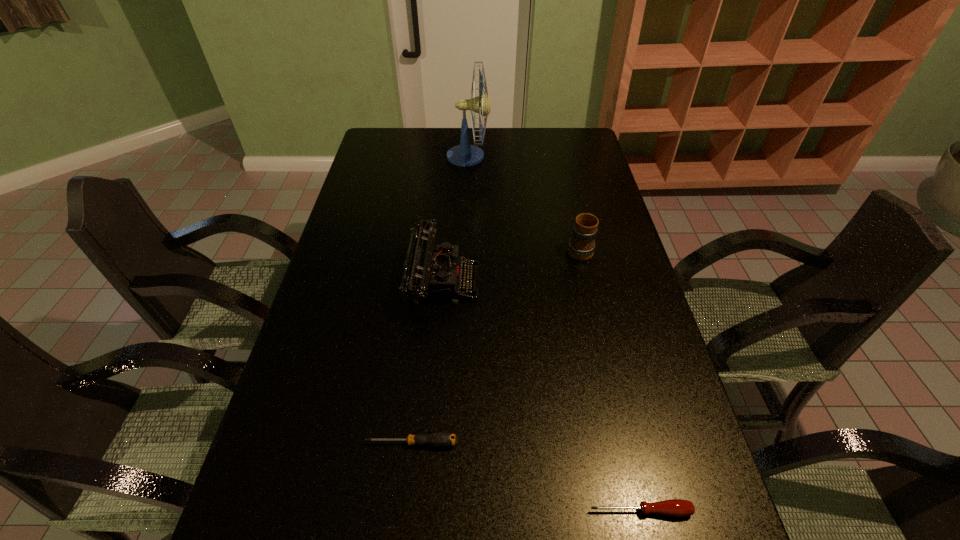
You are a GUI agent. You are given a task and a screenshot of the screen. Output one action in this format:
    pyautogui.click(x=<x>, y=<y>)
    Task: Click on the free space located 0.160m on the side of the mug with the handle
    Image resolution: width=960 pixels, height=540 pixels.
    Given the screenshot: What is the action you would take?
    pyautogui.click(x=569, y=205)

The height and width of the screenshot is (540, 960). I want to click on free spot located on the side of the mug with the handle, so click(x=570, y=209).

Image resolution: width=960 pixels, height=540 pixels. Identify the location of vacant region located 0.080m on the side of the mug with the handle. (573, 220).

Identify the location of vacant area situated 0.360m on the right of the left screwdriver. Image resolution: width=960 pixels, height=540 pixels. (628, 443).

I want to click on free space located on the left of the nearest object, so click(479, 511).

The width and height of the screenshot is (960, 540). What are the coordinates of `object that is positioned at the far edge` in the screenshot? It's located at (464, 154).

Where is `mug present at the right edge`? mug present at the right edge is located at coordinates (581, 246).

This screenshot has width=960, height=540. I want to click on screwdriver that is at the right edge, so click(x=674, y=507).

The image size is (960, 540). I want to click on vacant region at the far edge of the desktop, so click(x=500, y=156).

The image size is (960, 540). In the image, there is a desktop. What are the coordinates of `vacant area at the left edge` in the screenshot? It's located at (354, 246).